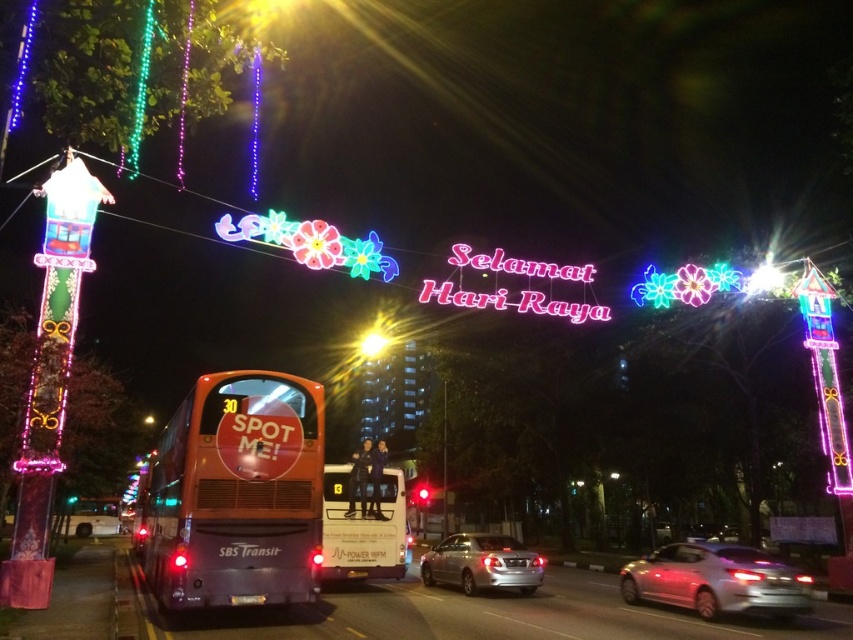
Question: Does orange matte/decorative bus at lower left appear under matte orange bus at center?

Choices:
 (A) yes
 (B) no

Answer: (B)

Question: Can you confirm if orange matte/decorative bus at lower left is positioned to the left of shiny silver sedan at center?

Choices:
 (A) no
 (B) yes

Answer: (B)

Question: Does matte orange bus at center have a greater width compared to silver metallic sedan at center?

Choices:
 (A) no
 (B) yes

Answer: (A)

Question: Based on their relative distances, which object is nearer to the orange matte/decorative bus at lower left?

Choices:
 (A) shiny silver sedan at center
 (B) silver metallic sedan at center
 (C) matte orange bus at center
 (D) bright yellow light at center

Answer: (C)

Question: Which point appears closest to the camera in this image?

Choices:
 (A) (453, 566)
 (B) (398, 563)

Answer: (B)

Question: Which of the following is the closest to the observer?

Choices:
 (A) (358, 522)
 (B) (361, 355)
 (C) (187, 396)
 (D) (711, 572)

Answer: (D)